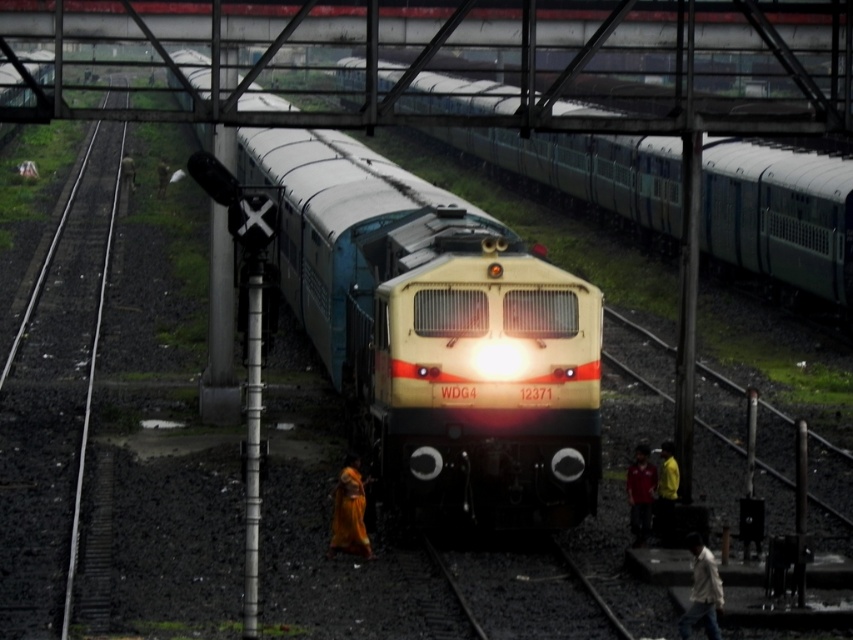
Question: Observing the image, what is the correct spatial positioning of matte yellow locomotive at center in reference to metallic blue train at center?

Choices:
 (A) right
 (B) left

Answer: (B)

Question: Which of the following is the farthest from the observer?

Choices:
 (A) (461, 88)
 (B) (514, 362)

Answer: (A)

Question: Among these objects, which one is farthest from the camera?

Choices:
 (A) metallic blue train at center
 (B) matte yellow locomotive at center

Answer: (A)

Question: Can you confirm if matte yellow locomotive at center is positioned to the left of metallic blue train at center?

Choices:
 (A) no
 (B) yes

Answer: (B)

Question: Does matte yellow locomotive at center have a smaller size compared to metallic blue train at center?

Choices:
 (A) yes
 (B) no

Answer: (A)